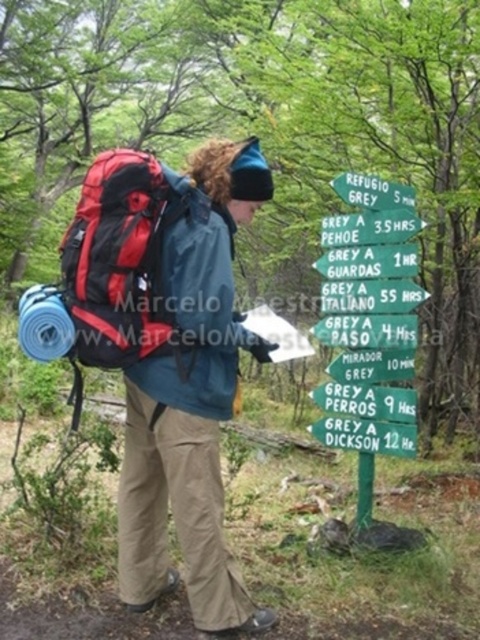
You are a hiker who needs to read the directions on the green wooden signpost at upper center. You are currently holding the red fabric backpack at left. Can you move the backpack to get a better view of the signpost?

The green wooden signpost at upper center occupies less space than the red fabric backpack at left, so moving the backpack might not be necessary since the signpost is smaller and easier to see around.

You are a hiker who just arrived at the forest trail. You see a green wooden signpost at upper center and a red fabric backpack at left. Which object is positioned more to the right from your perspective?

The green wooden signpost at upper center is positioned more to the right than the red fabric backpack at left.

Based on the photo, you are the hiker in the scene and need to check the signpost for directions. Can you reach the green wooden signpost at upper center without moving the red fabric backpack at left?

The green wooden signpost at upper center and red fabric backpack at left are 38.36 inches apart from each other. Since the distance between them is over 3 feet, you can easily reach the green wooden signpost at upper center without moving the red fabric backpack at left.